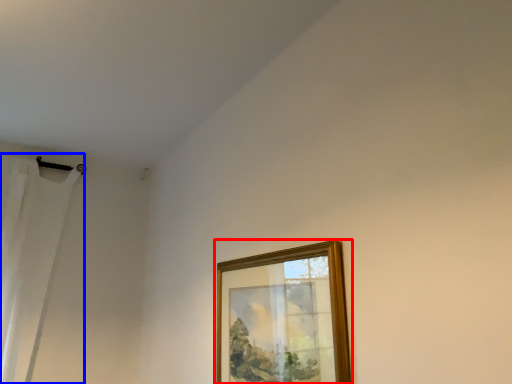
Question: Among these objects, which one is nearest to the camera, picture frame (highlighted by a red box) or curtain (highlighted by a blue box)?

Choices:
 (A) picture frame
 (B) curtain

Answer: (A)